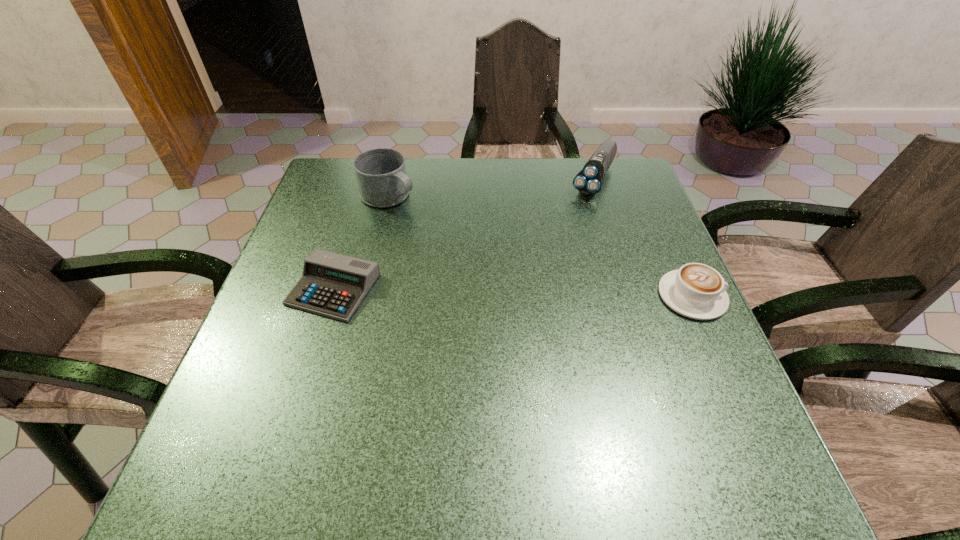
The width and height of the screenshot is (960, 540). Find the location of `vacant spot on the desktop that is between the calculator and the cappuccino and is positioned on the side of the tallest object with the handle`. vacant spot on the desktop that is between the calculator and the cappuccino and is positioned on the side of the tallest object with the handle is located at coordinates (548, 293).

At what (x,y) coordinates should I click in order to perform the action: click on free space on the desktop that is between the shortest object and the second shortest object and is positioned on the head of the second tallest object. Please return your answer as a coordinate pair (x, y). Looking at the image, I should click on (522, 293).